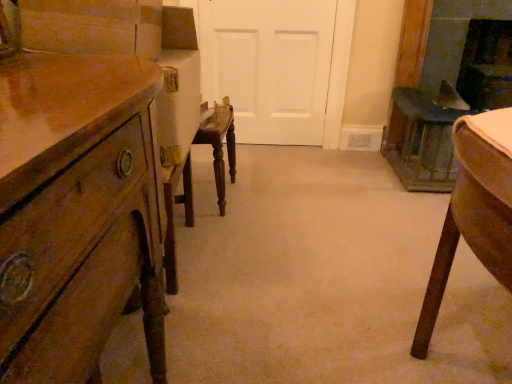
Question: Does white matte door at center have a smaller size compared to dark brown wood fireplace at upper right, the 2th fireplace viewed from the left?

Choices:
 (A) no
 (B) yes

Answer: (B)

Question: From the image's perspective, is white matte door at center above dark brown wood fireplace at upper right, the first fireplace in the right-to-left sequence?

Choices:
 (A) no
 (B) yes

Answer: (A)

Question: Does white matte door at center appear on the left side of dark brown wood fireplace at upper right, the 2th fireplace viewed from the left?

Choices:
 (A) no
 (B) yes

Answer: (B)

Question: From a real-world perspective, is white matte door at center over dark brown wood fireplace at upper right, the first fireplace in the right-to-left sequence?

Choices:
 (A) no
 (B) yes

Answer: (A)

Question: Can you confirm if white matte door at center is wider than dark brown wood fireplace at upper right, the first fireplace in the right-to-left sequence?

Choices:
 (A) no
 (B) yes

Answer: (A)

Question: From the image's perspective, is dark brown wood fireplace at upper right, the 2th fireplace viewed from the left, located above or below white matte door at center?

Choices:
 (A) below
 (B) above

Answer: (B)

Question: Is dark brown wood fireplace at upper right, the first fireplace in the right-to-left sequence, inside or outside of white matte door at center?

Choices:
 (A) inside
 (B) outside

Answer: (B)

Question: In terms of size, does dark brown wood fireplace at upper right, the 2th fireplace viewed from the left, appear bigger or smaller than white matte door at center?

Choices:
 (A) big
 (B) small

Answer: (A)

Question: In terms of height, does dark brown wood fireplace at upper right, the first fireplace in the right-to-left sequence, look taller or shorter compared to white matte door at center?

Choices:
 (A) tall
 (B) short

Answer: (B)

Question: Relative to dark brown wood fireplace at upper right, the first fireplace in the right-to-left sequence, is wooden chest of drawers at left in front or behind?

Choices:
 (A) front
 (B) behind

Answer: (A)

Question: In terms of size, does wooden chest of drawers at left appear bigger or smaller than dark brown wood fireplace at upper right, the 2th fireplace viewed from the left?

Choices:
 (A) small
 (B) big

Answer: (B)

Question: From a real-world perspective, is wooden chest of drawers at left above or below dark brown wood fireplace at upper right, the 2th fireplace viewed from the left?

Choices:
 (A) below
 (B) above

Answer: (A)

Question: Is wooden chest of drawers at left spatially inside dark brown wood fireplace at upper right, the first fireplace in the right-to-left sequence, or outside of it?

Choices:
 (A) inside
 (B) outside

Answer: (B)

Question: Is white matte door at center inside or outside of wooden chest of drawers at left?

Choices:
 (A) inside
 (B) outside

Answer: (B)

Question: Considering the positions of point (288, 117) and point (17, 137), is point (288, 117) closer or farther from the camera than point (17, 137)?

Choices:
 (A) farther
 (B) closer

Answer: (A)